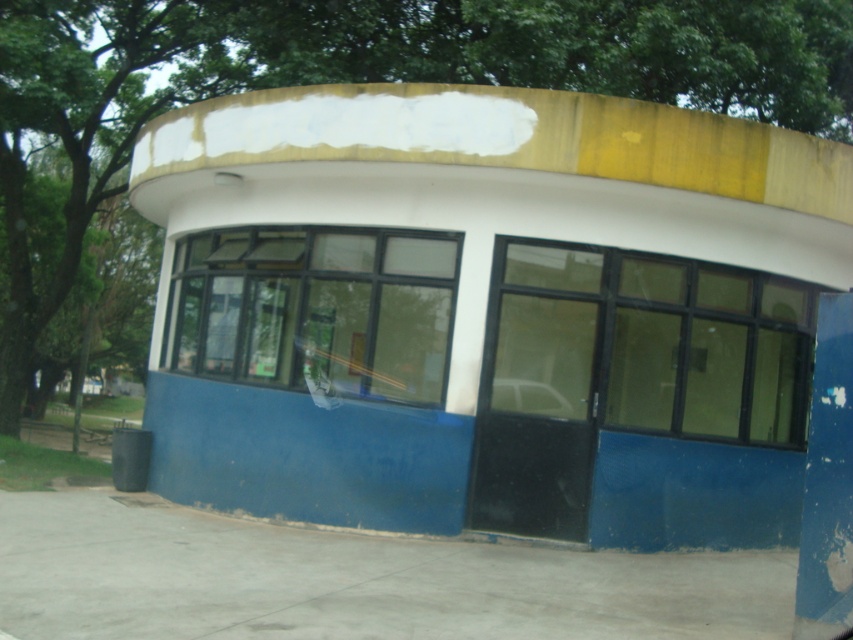
From the picture: Who is more distant from viewer, (196,241) or (563,417)?

Positioned behind is point (196,241).

In the scene shown: Who is taller, clear glass window at center or metallic silver car at center?

Standing taller between the two is clear glass window at center.

Where is `clear glass window at center`? This screenshot has height=640, width=853. clear glass window at center is located at coordinates (314, 310).

Locate an element on the screen. Image resolution: width=853 pixels, height=640 pixels. clear glass window at center is located at coordinates (314, 310).

Is the position of transparent glass window at center less distant than that of metallic silver car at center?

Yes, transparent glass window at center is closer to the viewer.

Is transparent glass window at center smaller than metallic silver car at center?

No, transparent glass window at center is not smaller than metallic silver car at center.

Does point (526, 355) lie in front of point (584, 412)?

No, it is behind (584, 412).

This screenshot has height=640, width=853. What are the coordinates of `transparent glass window at center` in the screenshot? It's located at (659, 340).

Does transparent glass window at center have a larger size compared to clear glass window at center?

Indeed, transparent glass window at center has a larger size compared to clear glass window at center.

Does transparent glass window at center appear on the right side of clear glass window at center?

Indeed, transparent glass window at center is positioned on the right side of clear glass window at center.

Who is more distant from viewer, (619,401) or (260,372)?

Point (260,372)

At what (x,y) coordinates should I click in order to perform the action: click on transparent glass window at center. Please return your answer as a coordinate pair (x, y). Image resolution: width=853 pixels, height=640 pixels. Looking at the image, I should click on (659, 340).